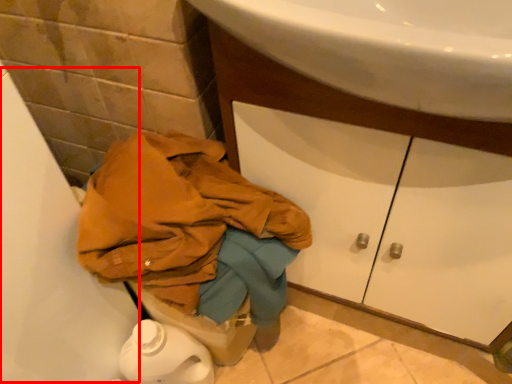
Question: Where is bath (annotated by the red box) located in relation to drawer in the image?

Choices:
 (A) left
 (B) right

Answer: (A)